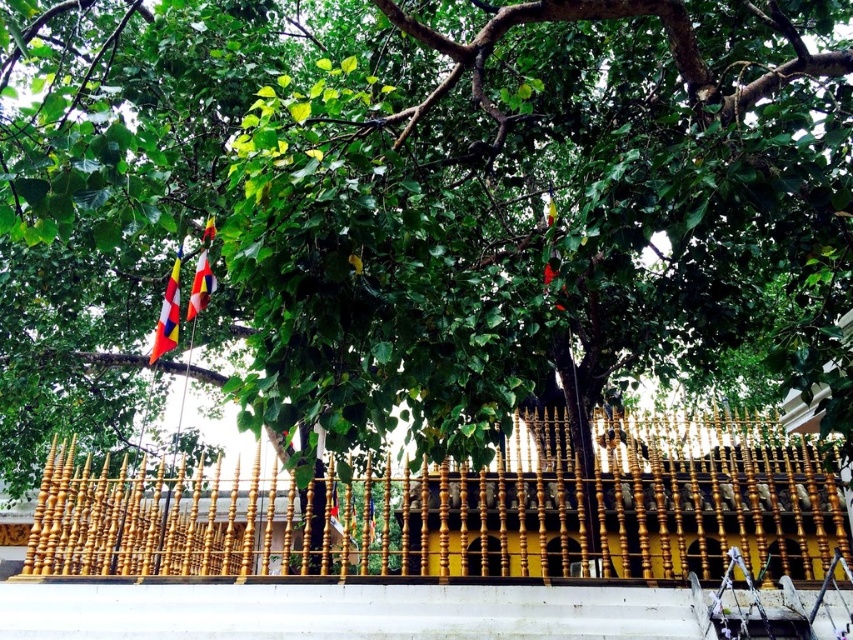
Question: Is gold polished wood fence at center smaller than multi-colored fabric flag at upper left?

Choices:
 (A) yes
 (B) no

Answer: (A)

Question: Which object is the closest to the multicolored fabric flag at left?

Choices:
 (A) gold polished wood fence at center
 (B) multi-colored fabric flag at upper left

Answer: (B)

Question: Observing the image, what is the correct spatial positioning of gold polished wood fence at center in reference to multicolored fabric flag at left?

Choices:
 (A) right
 (B) left

Answer: (A)

Question: Which is nearer to the multi-colored fabric flag at upper left?

Choices:
 (A) multicolored fabric flag at left
 (B) gold polished wood fence at center

Answer: (A)

Question: Can you confirm if gold polished wood fence at center is smaller than multi-colored fabric flag at upper left?

Choices:
 (A) no
 (B) yes

Answer: (B)

Question: Estimate the real-world distances between objects in this image. Which object is farther from the multi-colored fabric flag at upper left?

Choices:
 (A) multicolored fabric flag at left
 (B) gold polished wood fence at center

Answer: (B)